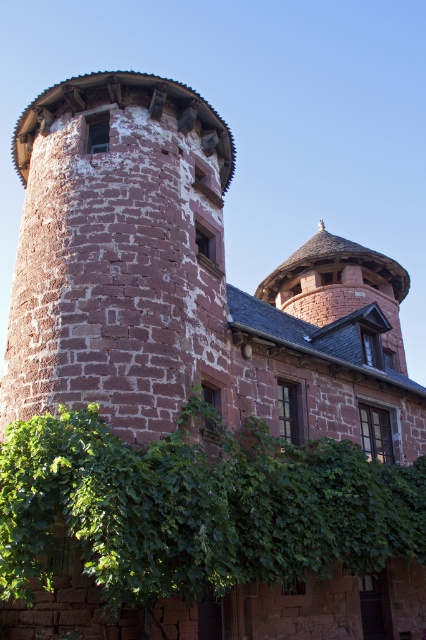
You are standing in front of the historic stone building and notice a specific point marked at coordinates (118, 252). Based on the scene description, can you determine which part of the building this point corresponds to?

The point at coordinates (118, 252) is located on the brown stone tower at left.

You are a painter standing at the base of the brown stone tower at left and the green leafy ivy at lower center. You want to paint both subjects. Which one will you need to look up more to paint?

The brown stone tower at left is taller than the green leafy ivy at lower center, so you will need to look up more to paint the brown stone tower at left.

Based on the photo, you are standing in front of the historic stone building and want to take a photo of the brown stone tower at left and the green leafy ivy at lower center. Which object should you position to the right side of your camera frame?

The green leafy ivy at lower center should be positioned to the right side of your camera frame because the brown stone tower at left is located to the left of it.